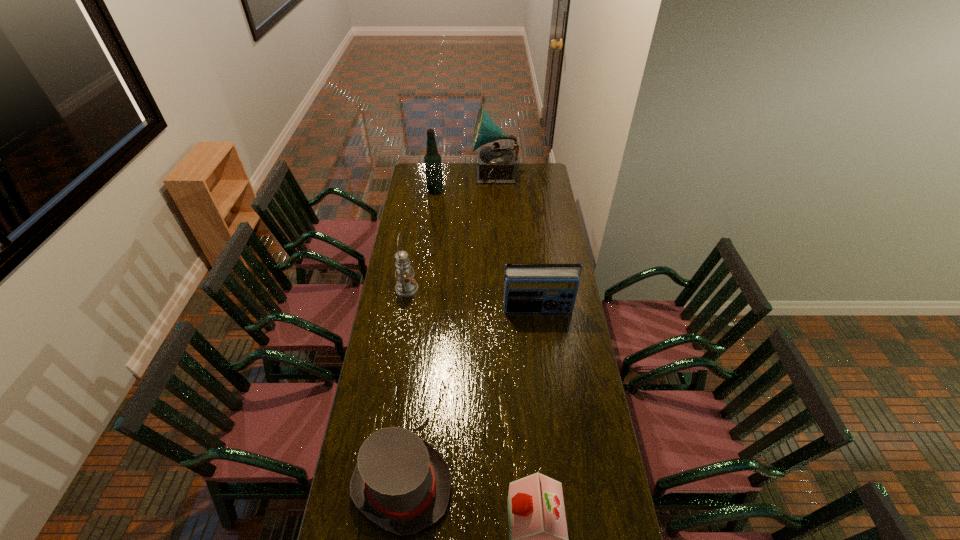
In the image, there is a desktop. Where is `vacant space at the far left corner`? The width and height of the screenshot is (960, 540). vacant space at the far left corner is located at coordinates (417, 169).

Find the location of a particular element. This screenshot has height=540, width=960. free space between the fourth farthest object and the record player is located at coordinates (516, 242).

Locate an element on the screen. This screenshot has height=540, width=960. free point between the radio receiver and the alcohol is located at coordinates (487, 250).

Find the location of `empty space between the oil lamp and the alcohol`. empty space between the oil lamp and the alcohol is located at coordinates (421, 240).

The image size is (960, 540). In order to click on vacant area between the shortest object and the third farthest object in this screenshot , I will do `click(404, 387)`.

You are a GUI agent. You are given a task and a screenshot of the screen. Output one action in this format:
    pyautogui.click(x=<x>, y=<y>)
    Task: Click on the vacant space that is in between the shortest object and the third nearest object
    This screenshot has height=540, width=960.
    Given the screenshot: What is the action you would take?
    pyautogui.click(x=469, y=397)

Find the location of `empty space that is in between the record player and the dress hat`. empty space that is in between the record player and the dress hat is located at coordinates (448, 330).

At what (x,y) coordinates should I click in order to perform the action: click on vacant space that is in between the dress hat and the alcohol. Please return your answer as a coordinate pair (x, y). This screenshot has height=540, width=960. Looking at the image, I should click on (419, 338).

Identify the location of vacant space that's between the alcohol and the oil lamp. The height and width of the screenshot is (540, 960). (421, 240).

Locate an element on the screen. object identified as the fifth closest to the dress hat is located at coordinates (496, 163).